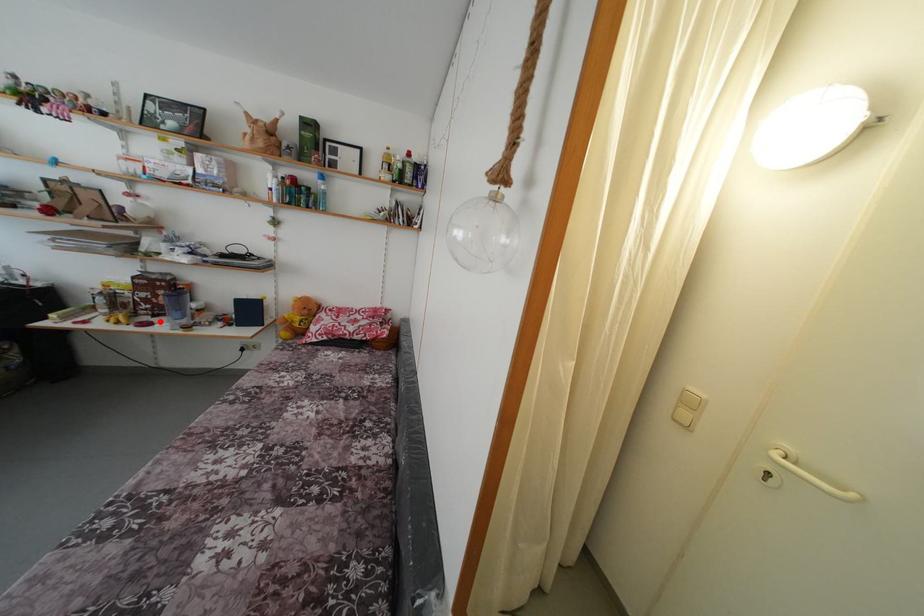
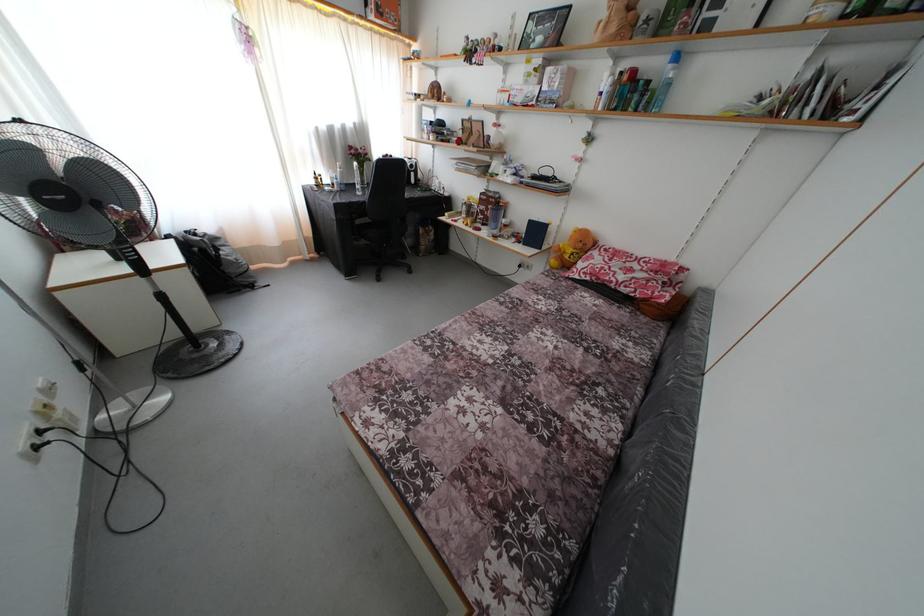
The point at the highlighted location is marked in the first image. Where is the corresponding point in the second image?

(488, 230)